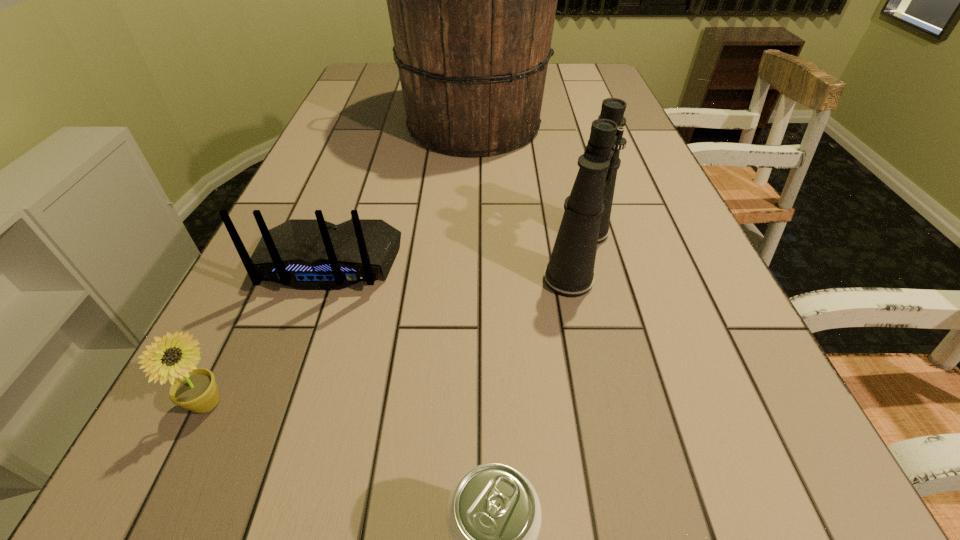
Where is `the tallest object`? the tallest object is located at coordinates (472, 0).

Where is `the farthest object`? the farthest object is located at coordinates (472, 0).

Identify the location of binoculars. This screenshot has height=540, width=960. (570, 272).

Identify the location of router. Image resolution: width=960 pixels, height=540 pixels. (306, 254).

In order to click on the fourth farthest object in this screenshot , I will do `click(195, 389)`.

Where is `free region located on the right of the farthest object`? The image size is (960, 540). free region located on the right of the farthest object is located at coordinates (585, 125).

I want to click on vacant region located on the front of the fourth shortest object, so click(601, 353).

The height and width of the screenshot is (540, 960). Find the location of `vacant space situated 0.250m on the back of the router`. vacant space situated 0.250m on the back of the router is located at coordinates (272, 424).

Find the location of a particular element. free point located 0.060m on the face of the fourth farthest object is located at coordinates (268, 404).

Find the location of a particular element. router present at the left edge is located at coordinates (306, 254).